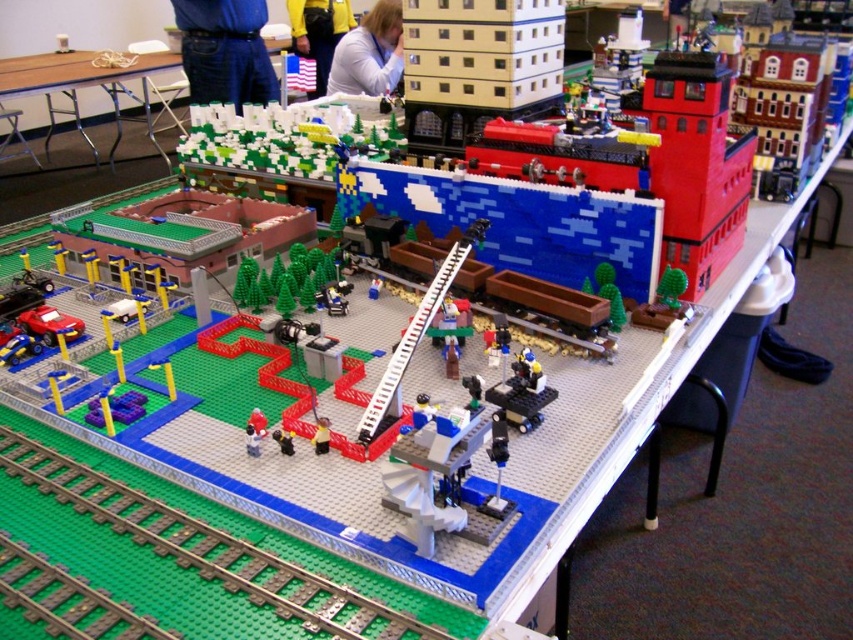
You are a Lego figure standing at the edge of the diorama. You notice two clothing items displayed at the upper center of the scene. The blue denim pants at upper center and the yellow fabric shirt at upper center. Which clothing item is positioned lower in the scene?

The blue denim pants at upper center is located below the yellow fabric shirt at upper center, so it is positioned lower in the scene.

Looking at this image, you are a Lego figure trying to decide which clothing item to wear for a performance. You have the blue denim pants at upper center and the yellow fabric shirt at upper center. Which item is narrower?

The blue denim pants at upper center is thinner than the yellow fabric shirt at upper center, so the blue denim pants at upper center is the narrower option.